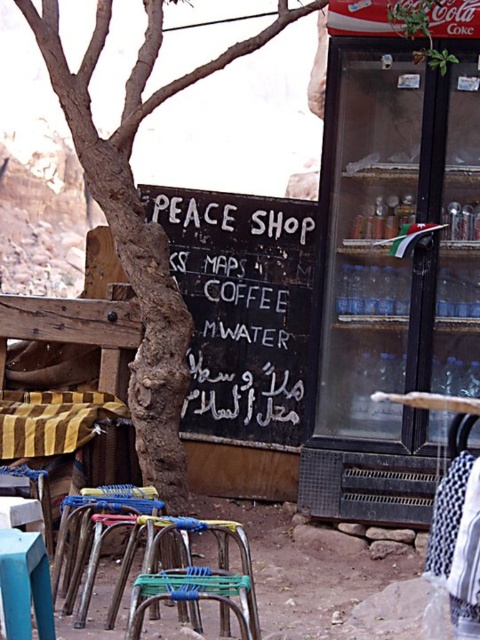
From the picture: You are a customer entering the PEACE SHOP and need to sit down. There is a metallic blue chair at lower center. Is the black chalkboard at center blocking your path to the chair?

The black chalkboard at center is positioned over the metallic blue chair at lower center, so the chalkboard is blocking the path to the chair.

You are standing in front of the PEACE SHOP and want to read the Arabic text on the black chalkboard at center. Considering your current distance, can you comfortably read the text without moving closer?

The black chalkboard at center is 7.10 meters away from the viewer. At this distance, it may be challenging to comfortably read the Arabic text without moving closer, as typical reading distance for small text is around 1 meter or closer.

You are a customer entering the PEACE SHOP and want to sit down. There is a metallic blue chair at lower center and a black chalkboard at center. Which object should you approach first to reach the chair?

You should approach the black chalkboard at center first because the metallic blue chair at lower center is behind it, so you need to go around or move past the chalkboard to reach the chair.